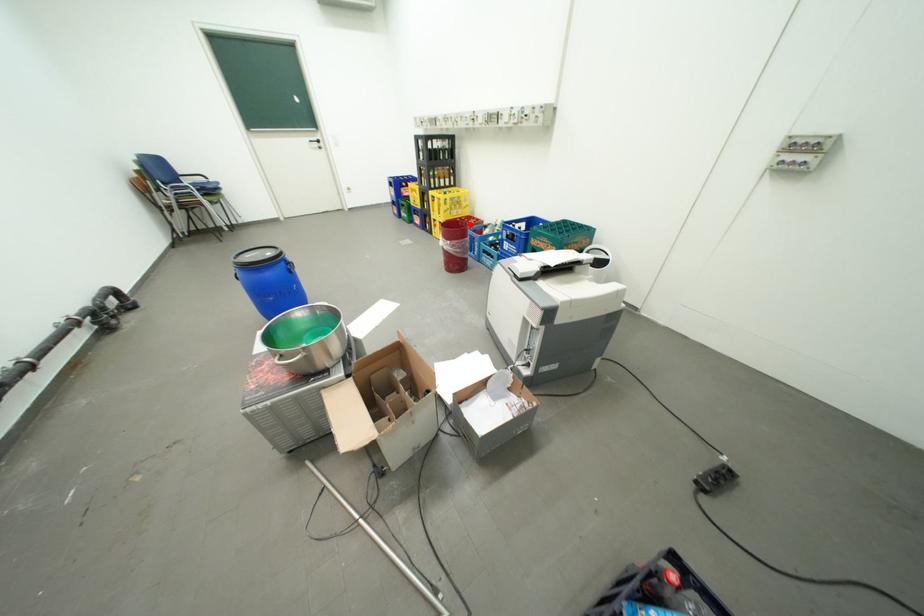
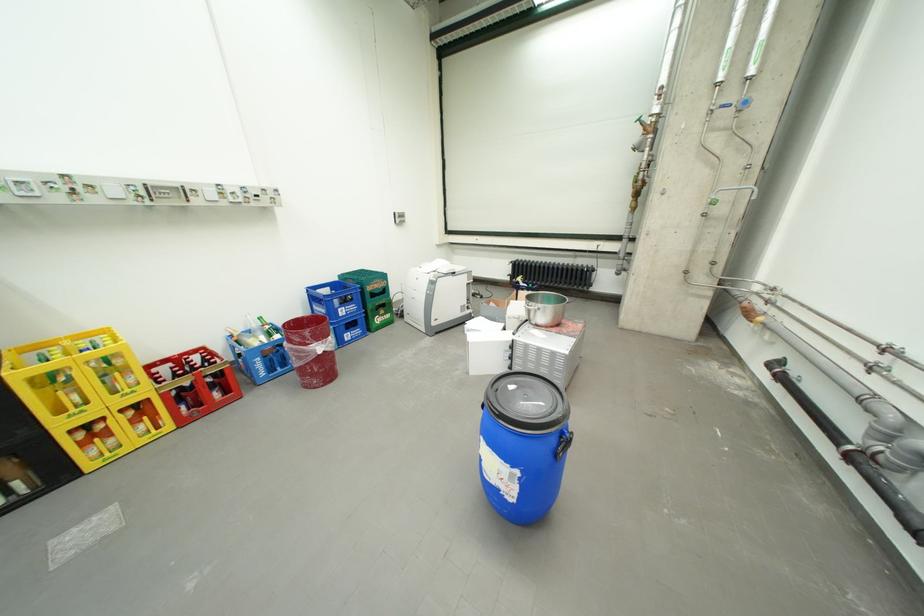
In the second image, find the point that corresponds to the highlighted location in the first image.

(297, 328)